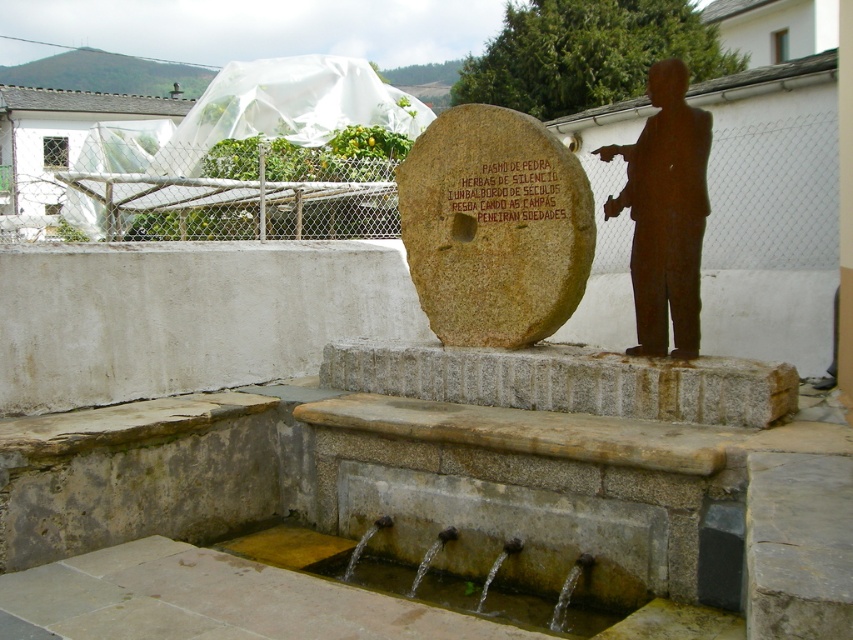
Question: Which point appears farthest from the camera in this image?

Choices:
 (A) (663, 205)
 (B) (589, 624)

Answer: (A)

Question: Which of the following is the farthest from the observer?

Choices:
 (A) 544,628
 (B) 663,307
 (C) 502,180

Answer: (C)

Question: In this image, where is rusty metal statue at right located relative to matte stone inscription at center?

Choices:
 (A) left
 (B) right

Answer: (B)

Question: Does brown stone millstone at center appear under clear water at fountain lower?

Choices:
 (A) no
 (B) yes

Answer: (A)

Question: Does brown stone millstone at center come in front of clear water at fountain lower?

Choices:
 (A) yes
 (B) no

Answer: (B)

Question: Which point is closer to the camera taking this photo?

Choices:
 (A) (473, 580)
 (B) (694, 342)

Answer: (A)